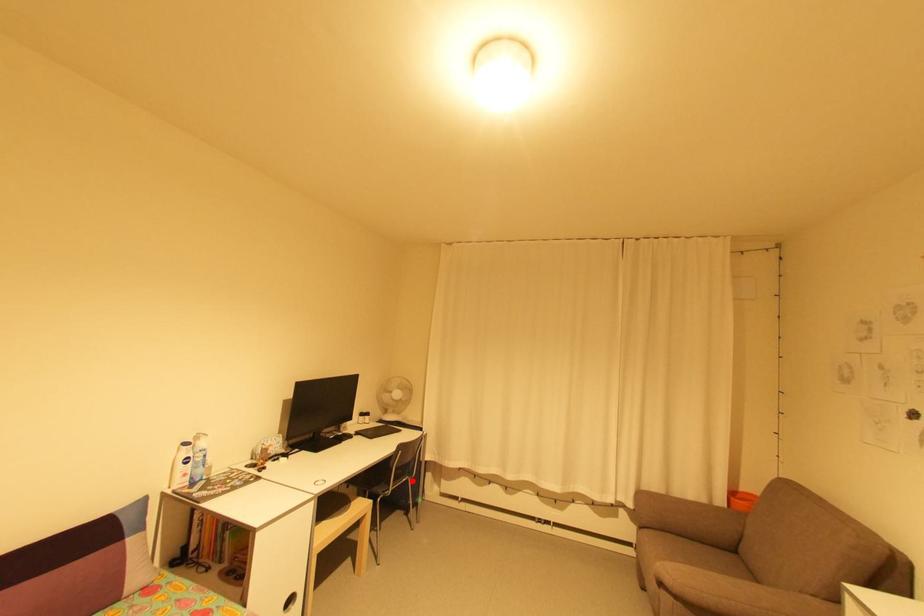
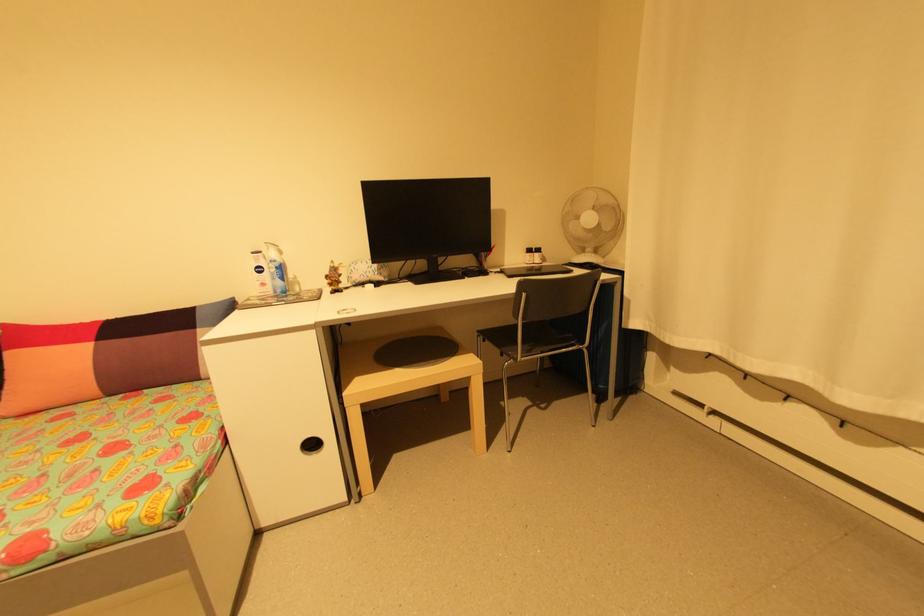
Find the pixel in the second image that matches the highlighted location in the first image.

(585, 352)